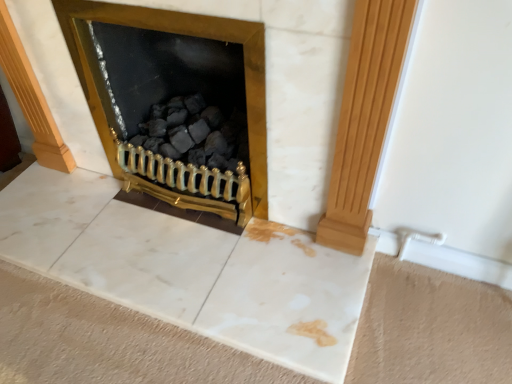
Question: Is light brown wood pillar at right aimed at gold metallic fireplace at center?

Choices:
 (A) yes
 (B) no

Answer: (B)

Question: Is light brown wood pillar at right at the left side of gold metallic fireplace at center?

Choices:
 (A) no
 (B) yes

Answer: (A)

Question: Is light brown wood pillar at right placed right next to gold metallic fireplace at center?

Choices:
 (A) yes
 (B) no

Answer: (B)

Question: From a real-world perspective, is light brown wood pillar at right on gold metallic fireplace at center?

Choices:
 (A) yes
 (B) no

Answer: (A)

Question: Is light brown wood pillar at right wider than gold metallic fireplace at center?

Choices:
 (A) yes
 (B) no

Answer: (B)

Question: Is gold metallic fireplace at center a part of light brown wood pillar at right?

Choices:
 (A) no
 (B) yes

Answer: (A)

Question: Can you confirm if gold metallic fireplace at center is thinner than light brown wood pillar at right?

Choices:
 (A) no
 (B) yes

Answer: (A)

Question: Is gold metallic fireplace at center completely or partially outside of light brown wood pillar at right?

Choices:
 (A) no
 (B) yes

Answer: (B)

Question: Can you confirm if gold metallic fireplace at center is taller than light brown wood pillar at right?

Choices:
 (A) no
 (B) yes

Answer: (A)

Question: From a real-world perspective, does gold metallic fireplace at center stand above light brown wood pillar at right?

Choices:
 (A) yes
 (B) no

Answer: (B)

Question: From a real-world perspective, is gold metallic fireplace at center positioned under light brown wood pillar at right based on gravity?

Choices:
 (A) yes
 (B) no

Answer: (A)

Question: From the image's perspective, does gold metallic fireplace at center appear lower than light brown wood pillar at right?

Choices:
 (A) no
 (B) yes

Answer: (A)

Question: In terms of size, does gold metallic fireplace at center appear bigger or smaller than light brown wood pillar at right?

Choices:
 (A) big
 (B) small

Answer: (A)